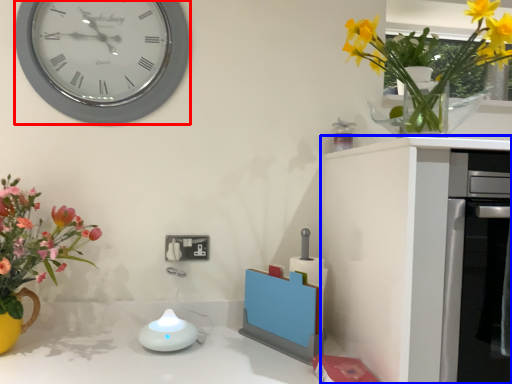
Question: Which of the following is the farthest to the observer, wall clock (highlighted by a red box) or cabinetry (highlighted by a blue box)?

Choices:
 (A) wall clock
 (B) cabinetry

Answer: (A)